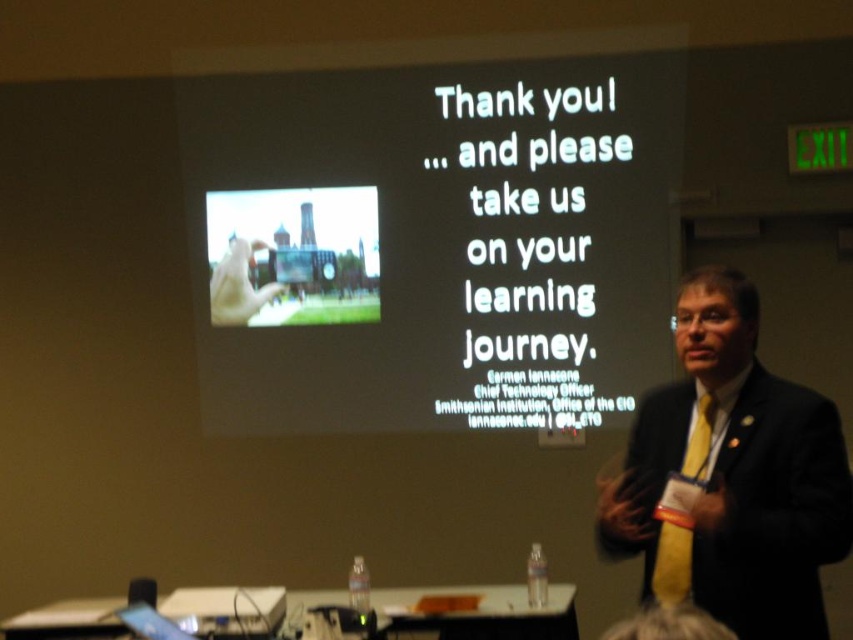
Question: Which point appears farthest from the camera in this image?

Choices:
 (A) (723, 429)
 (B) (672, 536)

Answer: (A)

Question: Which object is positioned farthest from the black suit at center?

Choices:
 (A) matte plastic phone at center
 (B) yellowtextured fabrictie at right

Answer: (A)

Question: Can you confirm if black suit at center is wider than yellowtextured fabrictie at right?

Choices:
 (A) no
 (B) yes

Answer: (B)

Question: Can you confirm if black suit at center is positioned to the right of yellowtextured fabrictie at right?

Choices:
 (A) yes
 (B) no

Answer: (A)

Question: Which object is farther from the camera taking this photo?

Choices:
 (A) matte plastic phone at center
 (B) black suit at center
 (C) white matte projector screen at upper center
 (D) yellowtextured fabrictie at right

Answer: (A)

Question: Can you confirm if black suit at center is positioned to the right of yellowtextured fabrictie at right?

Choices:
 (A) no
 (B) yes

Answer: (B)